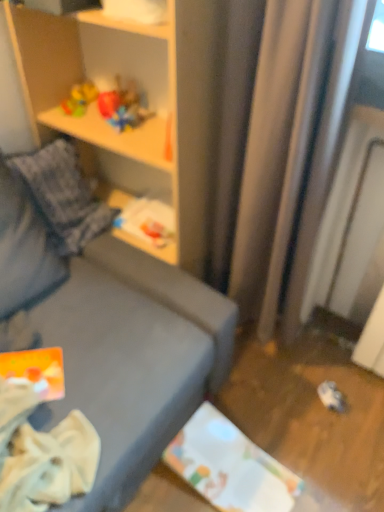
Question: From a real-world perspective, is wooden shelf at upper left above or below rubberized plastic toy at upper left?

Choices:
 (A) above
 (B) below

Answer: (B)

Question: In terms of width, does wooden shelf at upper left look wider or thinner when compared to rubberized plastic toy at upper left?

Choices:
 (A) wide
 (B) thin

Answer: (A)

Question: From the image's perspective, is wooden shelf at upper left located above or below rubberized plastic toy at upper left?

Choices:
 (A) below
 (B) above

Answer: (A)

Question: Considering the positions of rubberized plastic toy at upper left and wooden shelf at upper left in the image, is rubberized plastic toy at upper left taller or shorter than wooden shelf at upper left?

Choices:
 (A) tall
 (B) short

Answer: (B)

Question: Considering the relative positions of rubberized plastic toy at upper left and wooden shelf at upper left in the image provided, is rubberized plastic toy at upper left to the left or to the right of wooden shelf at upper left?

Choices:
 (A) left
 (B) right

Answer: (A)

Question: From the image's perspective, is rubberized plastic toy at upper left above or below wooden shelf at upper left?

Choices:
 (A) below
 (B) above

Answer: (B)

Question: Is rubberized plastic toy at upper left spatially inside wooden shelf at upper left, or outside of it?

Choices:
 (A) inside
 (B) outside

Answer: (A)